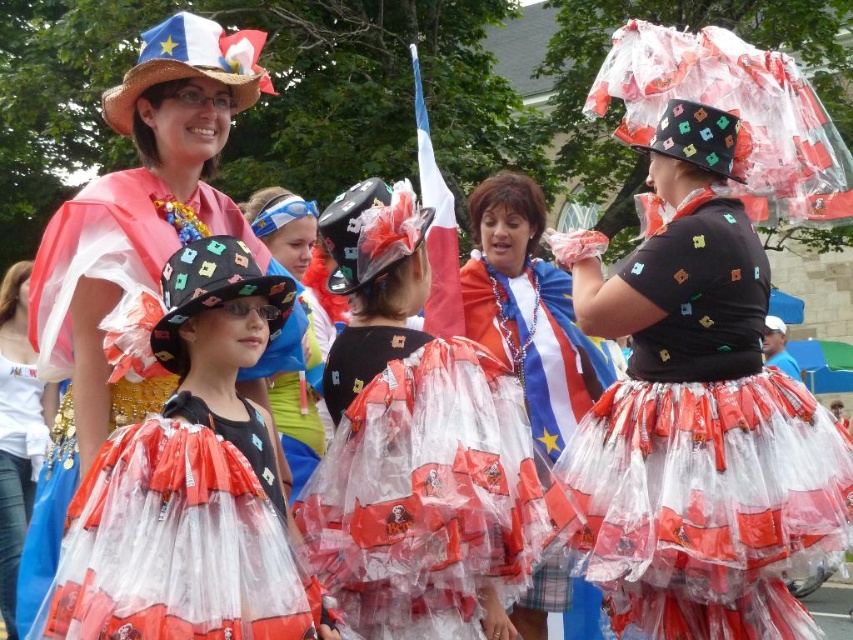
Question: Is translucent plastic dress at center to the left of matte black hat at upper left from the viewer's perspective?

Choices:
 (A) no
 (B) yes

Answer: (A)

Question: Which of the following is the closest to the observer?

Choices:
 (A) (9, 568)
 (B) (421, 250)

Answer: (B)

Question: Does matte plastic dress at center appear on the right side of shiny plastic dress at center?

Choices:
 (A) no
 (B) yes

Answer: (B)

Question: Estimate the real-world distances between objects in this image. Which object is farther from the shiny plastic skirt at center?

Choices:
 (A) shiny plastic dress at center
 (B) matte plastic dress at center
 (C) translucent plastic dress at center

Answer: (A)

Question: Which point is farther to the camera?

Choices:
 (A) (503, 637)
 (B) (16, 500)

Answer: (B)

Question: Is matte plastic dress at center to the left of shiny plastic skirt at center from the viewer's perspective?

Choices:
 (A) yes
 (B) no

Answer: (B)